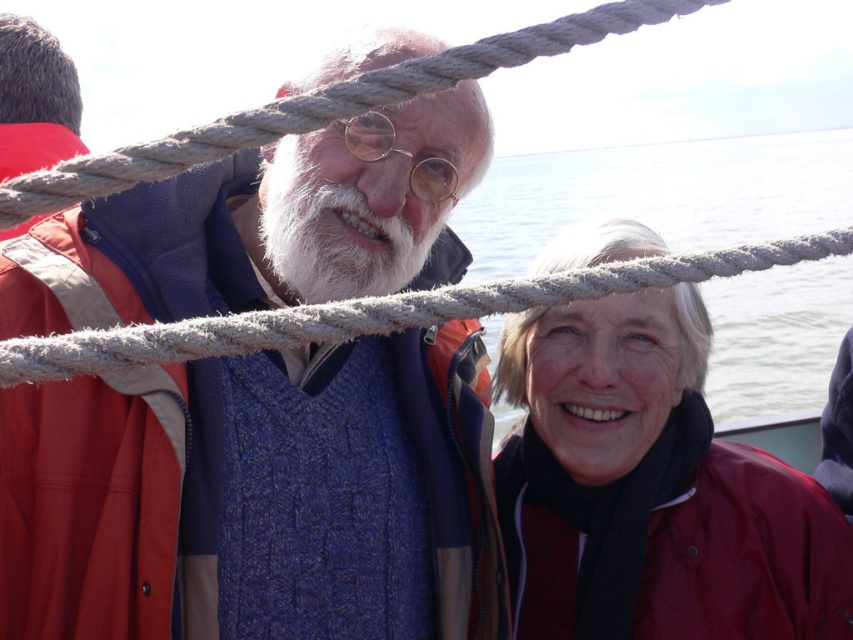
The image size is (853, 640). Find the location of `blue knitted sweater at center`. blue knitted sweater at center is located at coordinates (257, 497).

Does blue knitted sweater at center come behind matte red jacket at right?

No.

Is point (469, 589) positioned behind point (784, 554)?

No.

The image size is (853, 640). I want to click on blue knitted sweater at center, so click(x=257, y=497).

Does point (608, 580) come behind point (827, 156)?

No, it is not.

Does matte red jacket at right appear over clear water at upper center?

Actually, matte red jacket at right is below clear water at upper center.

Who is more forward, (582, 499) or (660, 230)?

Point (582, 499)

At what (x,y) coordinates should I click in order to perform the action: click on matte red jacket at right. Please return your answer as a coordinate pair (x, y). The width and height of the screenshot is (853, 640). Looking at the image, I should click on (650, 490).

The image size is (853, 640). What do you see at coordinates (659, 195) in the screenshot?
I see `clear water at upper center` at bounding box center [659, 195].

Is clear water at upper center thinner than burgundy fabric life jacket at lower right?

No.

What do you see at coordinates (659, 195) in the screenshot?
I see `clear water at upper center` at bounding box center [659, 195].

Locate an element on the screen. clear water at upper center is located at coordinates (659, 195).